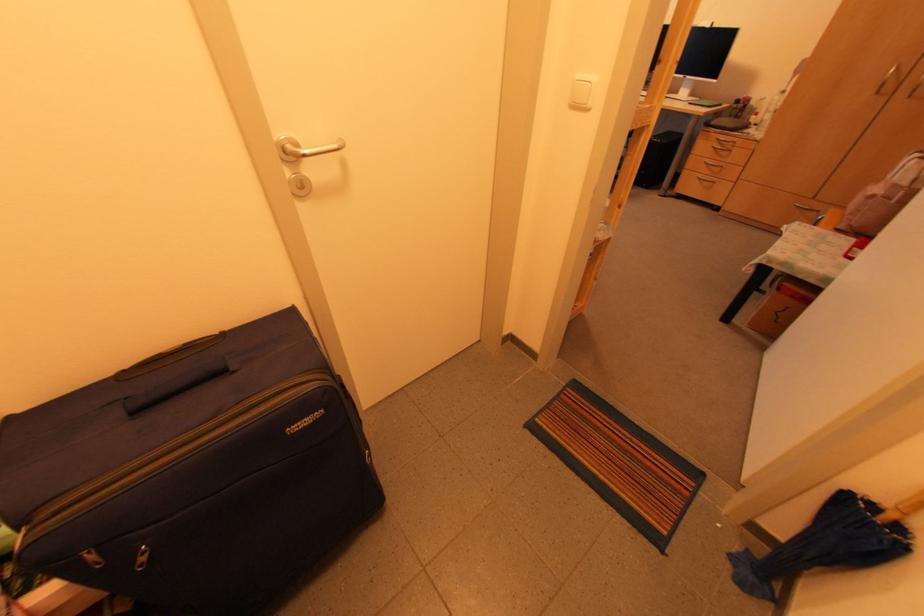
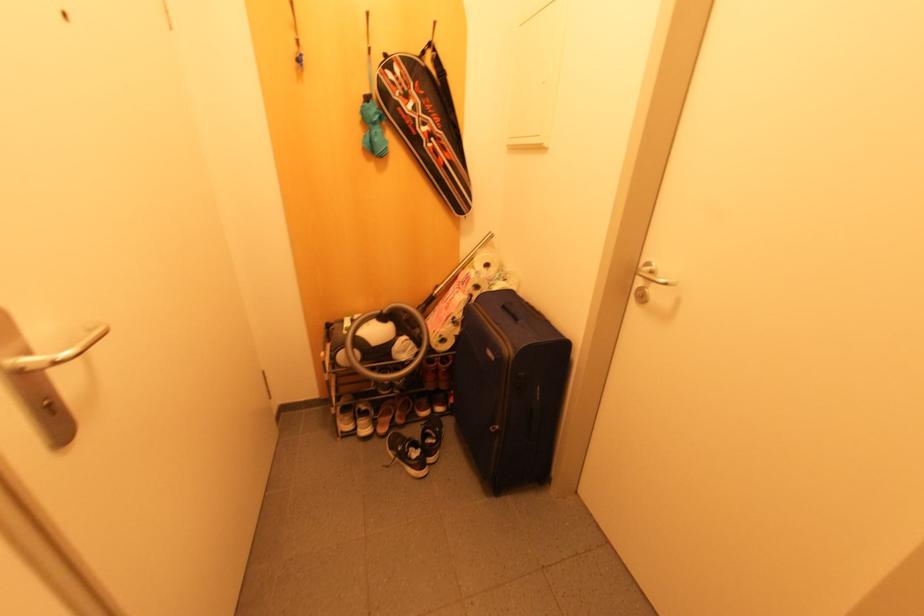
The point at (134, 413) is marked in the first image. Where is the corresponding point in the second image?

(503, 307)